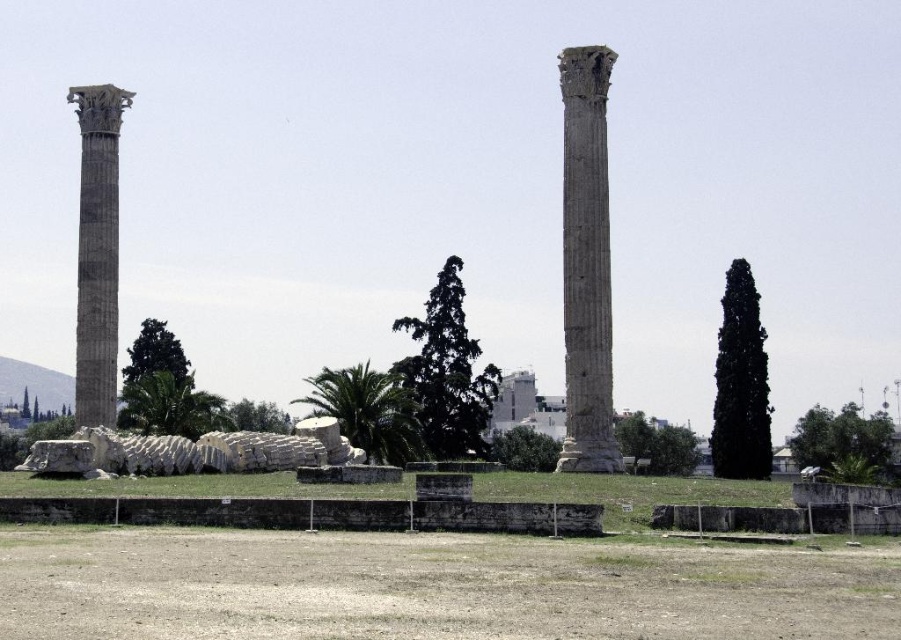
Question: Is smooth stone column at center further to the viewer compared to marble column at left?

Choices:
 (A) no
 (B) yes

Answer: (A)

Question: Which point is farther to the camera?

Choices:
 (A) smooth stone column at center
 (B) marble column at left

Answer: (B)

Question: Which point is farther from the camera taking this photo?

Choices:
 (A) (77, 256)
 (B) (563, 170)

Answer: (A)

Question: Is smooth stone column at center below marble column at left?

Choices:
 (A) yes
 (B) no

Answer: (A)

Question: Is smooth stone column at center to the right of marble column at left from the viewer's perspective?

Choices:
 (A) yes
 (B) no

Answer: (A)